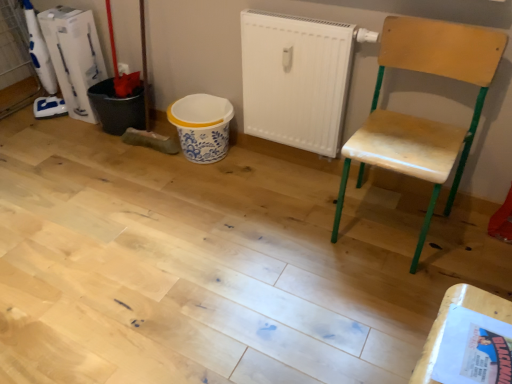
Question: Is white plastic bucket at left not close to wooden chair at right?

Choices:
 (A) yes
 (B) no

Answer: (A)

Question: Is white plastic bucket at left facing towards wooden chair at right?

Choices:
 (A) no
 (B) yes

Answer: (A)

Question: Would you say white plastic bucket at left is outside wooden chair at right?

Choices:
 (A) no
 (B) yes

Answer: (B)

Question: From the image's perspective, is white plastic bucket at left over wooden chair at right?

Choices:
 (A) yes
 (B) no

Answer: (A)

Question: From the image's perspective, is white plastic bucket at left beneath wooden chair at right?

Choices:
 (A) no
 (B) yes

Answer: (A)

Question: Considering the positions of white plastic bucket at left and wooden chair at right in the image, is white plastic bucket at left bigger or smaller than wooden chair at right?

Choices:
 (A) small
 (B) big

Answer: (A)

Question: Is white plastic bucket at left inside the boundaries of wooden chair at right, or outside?

Choices:
 (A) inside
 (B) outside

Answer: (B)

Question: From the image's perspective, is white plastic bucket at left positioned above or below wooden chair at right?

Choices:
 (A) above
 (B) below

Answer: (A)

Question: Is white plastic bucket at left wider or thinner than wooden chair at right?

Choices:
 (A) thin
 (B) wide

Answer: (A)

Question: Do you think white matte radiator at center is within wooden chair at right, or outside of it?

Choices:
 (A) inside
 (B) outside

Answer: (B)

Question: From their relative heights in the image, would you say white matte radiator at center is taller or shorter than wooden chair at right?

Choices:
 (A) tall
 (B) short

Answer: (B)

Question: From a real-world perspective, is white matte radiator at center physically located above or below wooden chair at right?

Choices:
 (A) below
 (B) above

Answer: (B)

Question: Considering the positions of white matte radiator at center and wooden chair at right in the image, is white matte radiator at center bigger or smaller than wooden chair at right?

Choices:
 (A) small
 (B) big

Answer: (A)

Question: Is point (480, 311) closer or farther from the camera than point (414, 57)?

Choices:
 (A) farther
 (B) closer

Answer: (B)

Question: Is wooden table at lower right situated inside wooden chair at right or outside?

Choices:
 (A) outside
 (B) inside

Answer: (A)